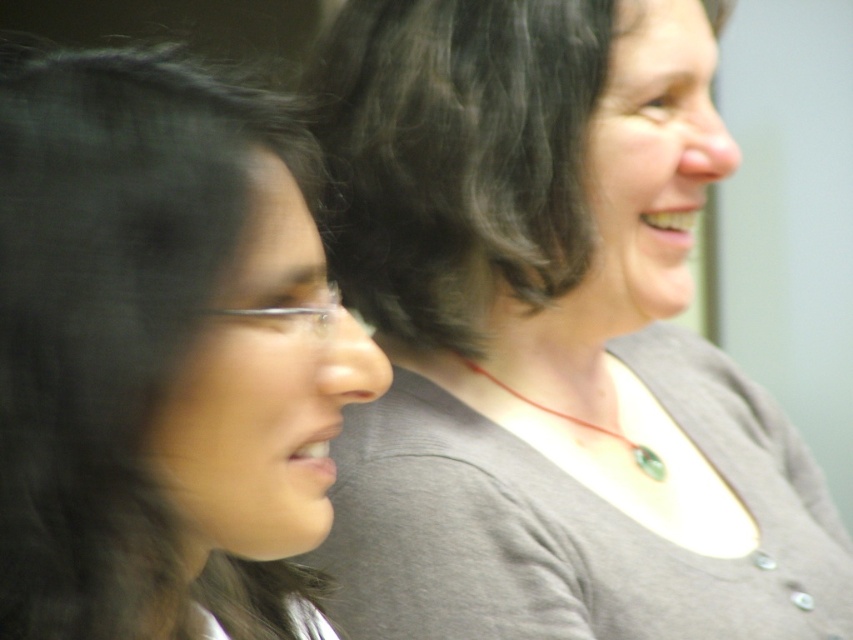
You are a photographer adjusting your camera to focus on the gray matte shirt at center. The camera can only focus on objects within a 2.5 inch range. Can you focus on the dark brown curly hair at upper center without refocusing?

The gray matte shirt at center is 3.09 inches away from the dark brown curly hair at upper center. Since the camera can only focus within a 2.5 inch range, focusing on the gray matte shirt at center would mean the dark brown curly hair at upper center is outside the focus range. Therefore, you need to refocus to capture both clearly.

You are a photographer adjusting the camera focus. The black hair at left and the gray matte necklace at center are both in the frame. Which object should you focus on first if you want to ensure the narrower subject is sharp?

The black hair at left should be focused on first because its width is narrower than the gray matte necklace at center, making it harder to capture sharply.